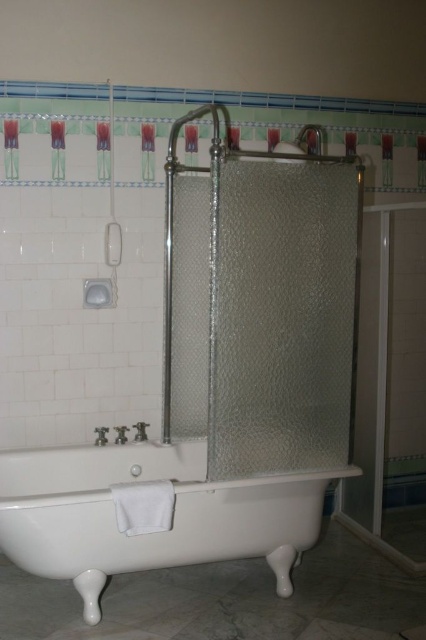
Question: Can you confirm if white glossy bathtub at lower center is positioned below clear glass shower at upper center?

Choices:
 (A) no
 (B) yes

Answer: (B)

Question: Is white glossy bathtub at lower center bigger than clear glass shower at upper center?

Choices:
 (A) yes
 (B) no

Answer: (A)

Question: Which point appears farthest from the camera in this image?

Choices:
 (A) (322, 147)
 (B) (164, 541)

Answer: (A)

Question: Which object is closer to the camera taking this photo?

Choices:
 (A) white glossy bathtub at lower center
 (B) clear glass shower at upper center

Answer: (A)

Question: Among these points, which one is nearest to the camera?

Choices:
 (A) (14, 465)
 (B) (316, 134)

Answer: (A)

Question: Does white glossy bathtub at lower center have a larger size compared to clear glass shower at upper center?

Choices:
 (A) yes
 (B) no

Answer: (A)